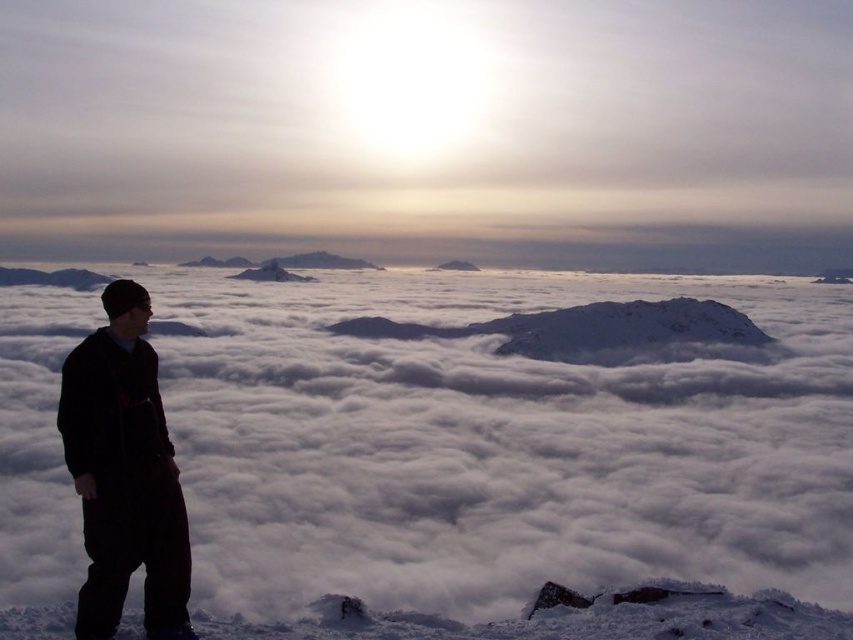
You are a photographer planning to capture a sunrise shot from this snowy mountain. You notice the white matte snow at left and the dark gray fleece jacket at left in your camera frame. Based on their positions, which object should you focus on first to ensure it appears sharp in the foreground?

The dark gray fleece jacket at left should be focused on first since it is closer to the camera than the white matte snow at left, which is positioned above it and farther away.

You are a mountaineer planning to descend from the snowy mountain. You see the white matte snow at left. Based on its position, which direction should you head to reach the snow?

The white matte snow at left is located at point (497, 444), so you should head towards the left direction to reach it.